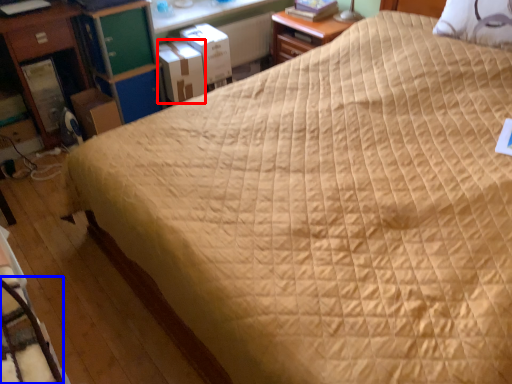
Question: Which object is closer to the camera taking this photo, cardboard box (highlighted by a red box) or rocking chair (highlighted by a blue box)?

Choices:
 (A) cardboard box
 (B) rocking chair

Answer: (B)